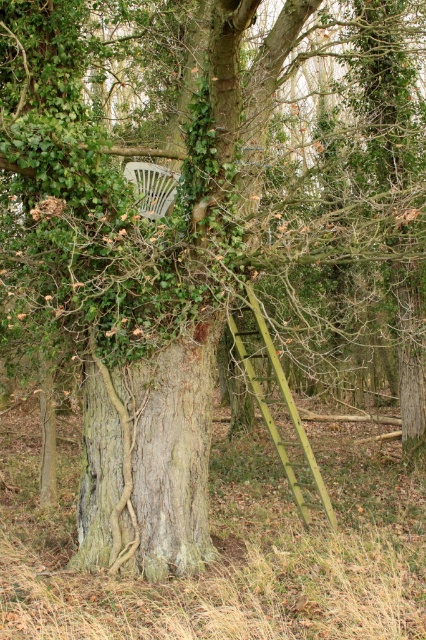
Between smooth bark tree trunk at center and white plastic chair at center, which one is positioned lower?

Positioned lower is smooth bark tree trunk at center.

In the scene shown: Can you confirm if smooth bark tree trunk at center is thinner than white plastic chair at center?

No.

Does point (196, 428) lie in front of point (166, 198)?

Yes, it is.

You are a GUI agent. You are given a task and a screenshot of the screen. Output one action in this format:
    pyautogui.click(x=<x>, y=<y>)
    Task: Click on the smooth bark tree trunk at center
    
    Given the screenshot: What is the action you would take?
    pyautogui.click(x=149, y=460)